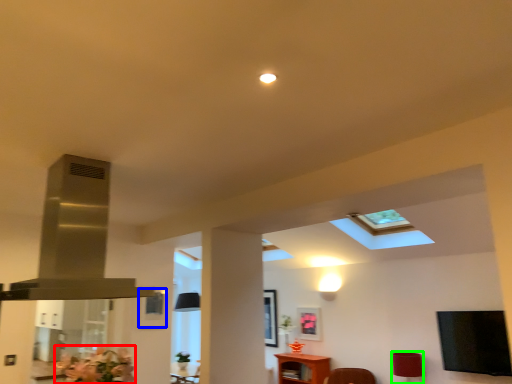
Question: Which object is positioned farthest from flower (highlighted by a red box)? Select from picture frame (highlighted by a blue box) and lamp (highlighted by a green box).

Choices:
 (A) picture frame
 (B) lamp

Answer: (B)